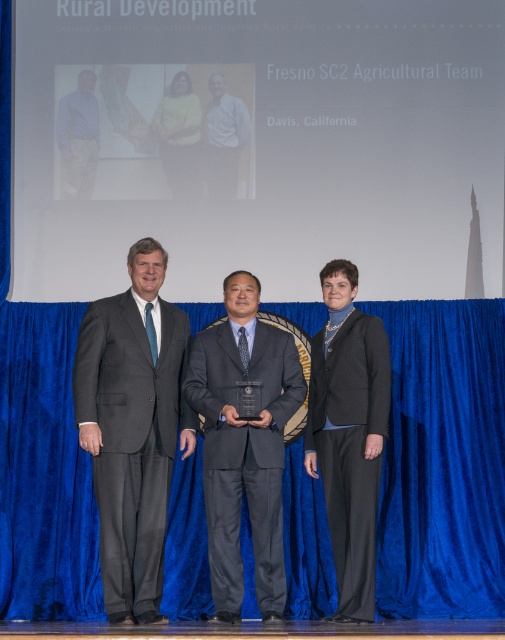
Question: Which of the following is the farthest from the observer?

Choices:
 (A) matte blue shirt at left
 (B) gray suit at center
 (C) dark gray suit at center
 (D) blue velvet curtain at center

Answer: (A)

Question: Which of the following is the farthest from the observer?

Choices:
 (A) black wool suit at center
 (B) matte gray suit at center

Answer: (B)

Question: Considering the relative positions of blue velvet curtain at center and dark gray suit at center in the image provided, where is blue velvet curtain at center located with respect to dark gray suit at center?

Choices:
 (A) left
 (B) right

Answer: (B)

Question: Is gray suit at center closer to camera compared to black wool suit at center?

Choices:
 (A) yes
 (B) no

Answer: (A)

Question: Is black wool suit at center above matte gray suit at center?

Choices:
 (A) yes
 (B) no

Answer: (B)

Question: Which point is closer to the camera?

Choices:
 (A) (485, 378)
 (B) (139, 570)

Answer: (B)